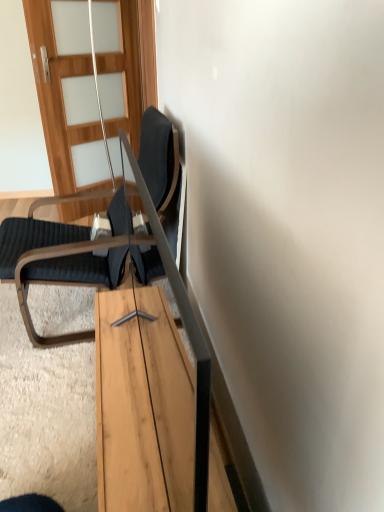
Measure the distance between light wood table at center and camera.

The depth of light wood table at center is 3.43 feet.

Describe the element at coordinates (67, 93) in the screenshot. I see `wooden with frosted glass at upper left` at that location.

Where is `dark gray fabric chair at left`? The width and height of the screenshot is (384, 512). dark gray fabric chair at left is located at coordinates (62, 255).

Locate an element on the screen. light wood table at center is located at coordinates (124, 414).

Which object is further away from the camera, wooden with frosted glass at upper left or dark gray fabric chair at left?

wooden with frosted glass at upper left is further from the camera.

Between point (84, 209) and point (155, 191), which one is positioned in front?

The point (155, 191) is in front.

From the picture: Is wooden with frosted glass at upper left taller or shorter than dark gray fabric chair at left?

Clearly, wooden with frosted glass at upper left is taller compared to dark gray fabric chair at left.

From a real-world perspective, who is located lower, wooden with frosted glass at upper left or dark gray fabric chair at left?

In real-world perspective, dark gray fabric chair at left is lower.

Is dark gray fabric chair at left at the right side of light wood table at center?

No.

This screenshot has height=512, width=384. In the image, there is a light wood table at center. Find the location of `chair above it (from the image's perspective)`. chair above it (from the image's perspective) is located at coordinates (62, 255).

Is dark gray fabric chair at left taller or shorter than light wood table at center?

Considering their sizes, dark gray fabric chair at left has more height than light wood table at center.

Is dark gray fabric chair at left in front of or behind light wood table at center in the image?

dark gray fabric chair at left is behind light wood table at center.

Is there a large distance between light wood table at center and wooden with frosted glass at upper left?

Indeed, light wood table at center is not near wooden with frosted glass at upper left.

Is light wood table at center at the left side of wooden with frosted glass at upper left?

Incorrect, light wood table at center is not on the left side of wooden with frosted glass at upper left.

Is light wood table at center in front of wooden with frosted glass at upper left?

Yes, the depth of light wood table at center is less than that of wooden with frosted glass at upper left.

Can you tell me how much light wood table at center and wooden with frosted glass at upper left differ in facing direction?

The angular difference between light wood table at center and wooden with frosted glass at upper left is 0.192 degrees.

From a real-world perspective, does light wood table at center stand above dark gray fabric chair at left?

Incorrect, from a real-world perspective, light wood table at center is lower than dark gray fabric chair at left.

Locate an element on the screen. This screenshot has height=512, width=384. chair behind the light wood table at center is located at coordinates (62, 255).

Between point (155, 482) and point (85, 279), which one is positioned in front?

The point (155, 482) is more forward.

Are light wood table at center and dark gray fabric chair at left located far from each other?

Actually, light wood table at center and dark gray fabric chair at left are a little close together.

Is wooden with frosted glass at upper left positioned far away from light wood table at center?

wooden with frosted glass at upper left is positioned a significant distance from light wood table at center.

How much distance is there between wooden with frosted glass at upper left and light wood table at center?

wooden with frosted glass at upper left and light wood table at center are 1.83 meters apart.

Is point (104, 84) farther from camera compared to point (157, 387)?

Yes, point (104, 84) is farther from viewer.

From a real-world perspective, which is physically above, wooden with frosted glass at upper left or light wood table at center?

wooden with frosted glass at upper left.

Is dark gray fabric chair at left taller than wooden with frosted glass at upper left?

Incorrect, the height of dark gray fabric chair at left is not larger of that of wooden with frosted glass at upper left.

Where is `door behind the dark gray fabric chair at left`? This screenshot has width=384, height=512. door behind the dark gray fabric chair at left is located at coordinates (67, 93).

From the image's perspective, is dark gray fabric chair at left located above or below wooden with frosted glass at upper left?

Clearly, from the image's perspective, dark gray fabric chair at left is below wooden with frosted glass at upper left.

Is dark gray fabric chair at left oriented away from wooden with frosted glass at upper left?

No, dark gray fabric chair at left's orientation is not away from wooden with frosted glass at upper left.

Image resolution: width=384 pixels, height=512 pixels. Identify the location of door behind the dark gray fabric chair at left. (67, 93).

The height and width of the screenshot is (512, 384). What are the coordinates of `table located below the dark gray fabric chair at left (from the image's perspective)` in the screenshot? It's located at (124, 414).

Looking at the image, which one is located closer to dark gray fabric chair at left, light wood table at center or wooden with frosted glass at upper left?

light wood table at center lies closer to dark gray fabric chair at left than the other object.

Which object lies further to the anchor point light wood table at center, wooden with frosted glass at upper left or dark gray fabric chair at left?

wooden with frosted glass at upper left lies further to light wood table at center than the other object.

Looking at the image, which one is located closer to light wood table at center, dark gray fabric chair at left or wooden with frosted glass at upper left?

dark gray fabric chair at left is positioned closer to the anchor light wood table at center.

When comparing their distances from wooden with frosted glass at upper left, does dark gray fabric chair at left or light wood table at center seem closer?

Based on the image, dark gray fabric chair at left appears to be nearer to wooden with frosted glass at upper left.

Which object lies further to the anchor point wooden with frosted glass at upper left, light wood table at center or dark gray fabric chair at left?

Among the two, light wood table at center is located further to wooden with frosted glass at upper left.

From the picture: From the image, which object appears to be farther from dark gray fabric chair at left, wooden with frosted glass at upper left or light wood table at center?

wooden with frosted glass at upper left is further to dark gray fabric chair at left.

Identify the location of chair between wooden with frosted glass at upper left and light wood table at center from top to bottom. (62, 255).